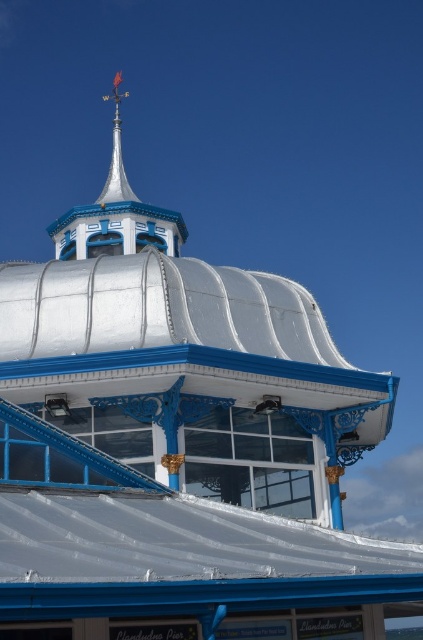
You are a bird flying over the pier structure. You see the shiny blue spire at upper center and the shiny silver spire at top. Which one is higher up in the sky?

The shiny silver spire at top is higher up in the sky than the shiny blue spire at upper center because it is located above it.

You are standing in front of the decorative structure and notice two points marked on the image. Which of the two points, point (115,193) or point (120,164), is closer to you?

Point (115,193) is closer to the viewer than point (120,164).